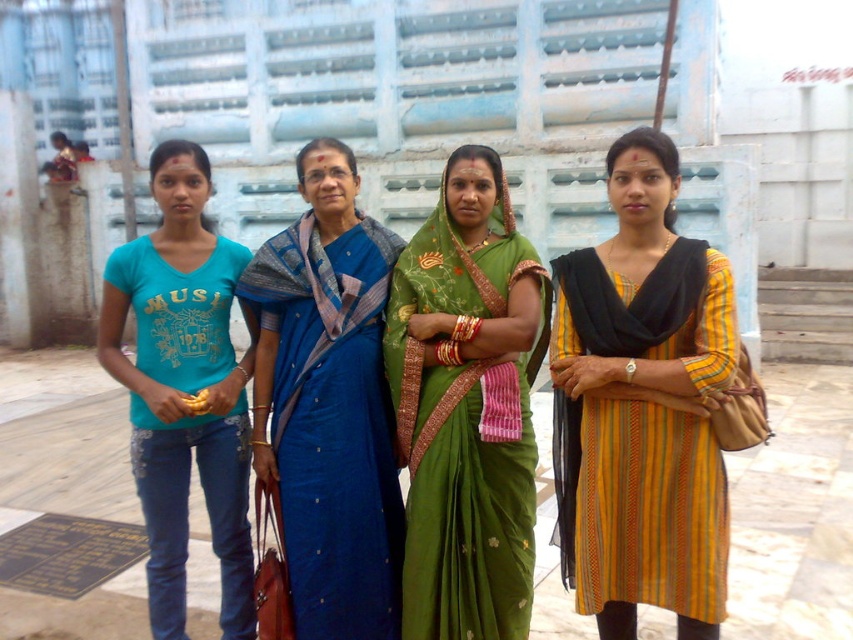
Based on the coordinates provided, which object is located at point (642,406)?

The point (642,406) marks the yellow striped dress at center.

Based on the scene description, which object is positioned to the right of the other between the yellow striped dress at center and the blue silk saree at center?

The yellow striped dress at center is positioned to the right of the blue silk saree at center.